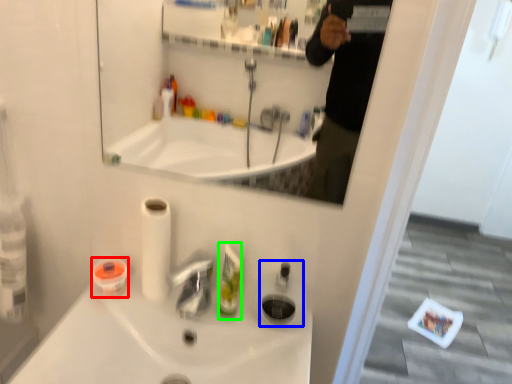
Question: Based on their relative distances, which object is farther from mouthwash (highlighted by a red box)? Choose from soap dispenser (highlighted by a blue box) and mouthwash (highlighted by a green box).

Choices:
 (A) soap dispenser
 (B) mouthwash

Answer: (A)